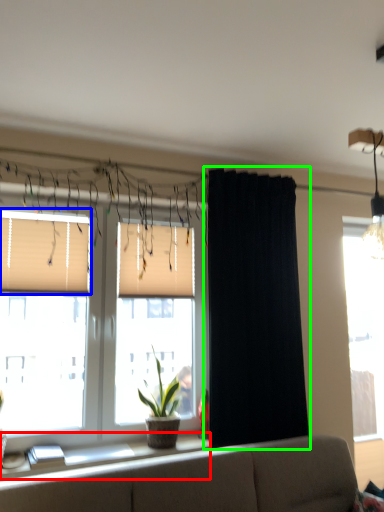
Question: Based on their relative distances, which object is nearer to window sill (highlighted by a red box)? Choose from window blind (highlighted by a blue box) and curtain (highlighted by a green box).

Choices:
 (A) window blind
 (B) curtain

Answer: (B)